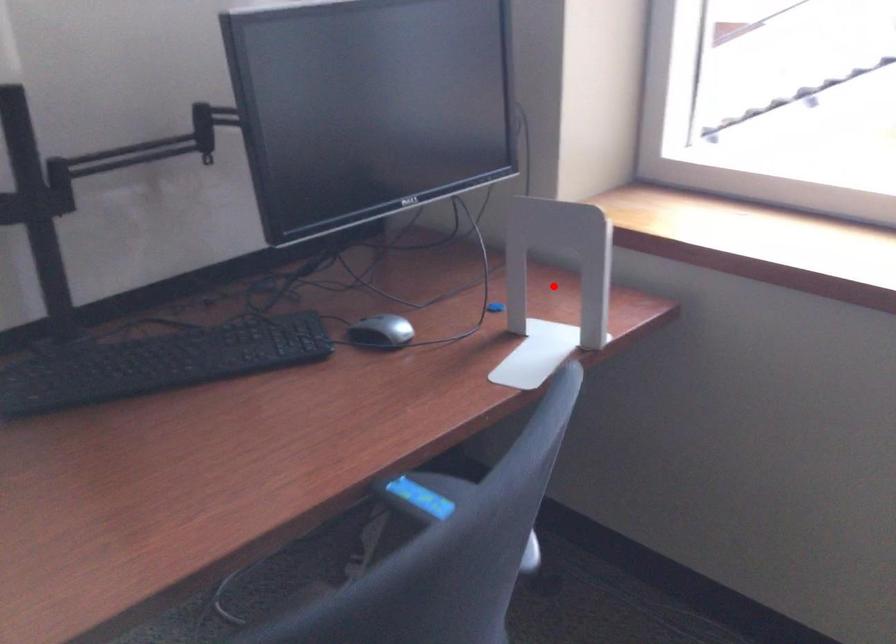
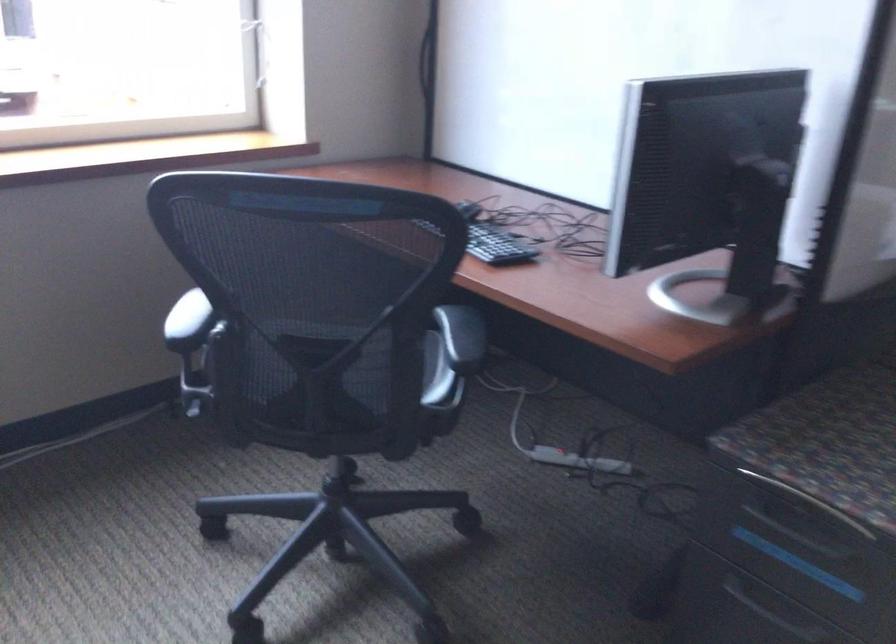
Question: I am providing you with two images of the same scene from different viewpoints. A red point is marked on the first image. At the location where the point appears in image 1, is it still visible in image 2?

Choices:
 (A) Yes
 (B) No

Answer: (B)